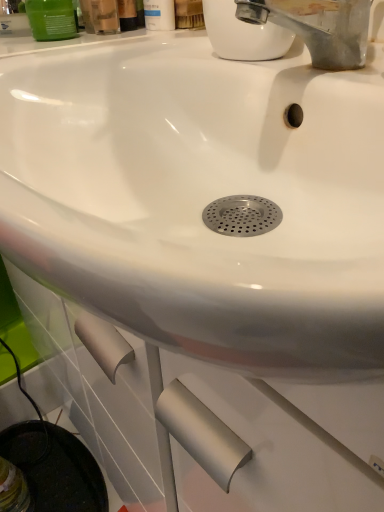
I want to click on free space in front of matte plastic mouthwash at upper center, arranged as the 2th mouthwash when viewed from the right, so click(140, 50).